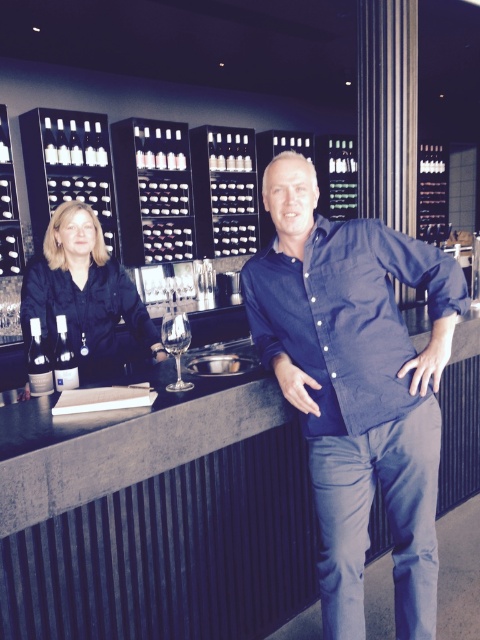
How much distance is there between dark blue denim shirt at center and clear glass wine glass at center?

19.58 inches

Where is `dark blue denim shirt at center`? The image size is (480, 640). dark blue denim shirt at center is located at coordinates (357, 387).

Can you confirm if matte black shirt at left is positioned above clear glass wine glass at center?

Yes.

Is the position of matte black shirt at left more distant than that of clear glass wine glass at center?

Yes, matte black shirt at left is further from the viewer.

At what (x,y) coordinates should I click in order to perform the action: click on matte black shirt at left. Please return your answer as a coordinate pair (x, y). Looking at the image, I should click on (84, 289).

Which of these two, dark blue denim shirt at center or matte black shirt at left, stands shorter?

With less height is matte black shirt at left.

Which is more to the right, dark blue denim shirt at center or matte black shirt at left?

dark blue denim shirt at center

What do you see at coordinates (357, 387) in the screenshot? Image resolution: width=480 pixels, height=640 pixels. I see `dark blue denim shirt at center` at bounding box center [357, 387].

Image resolution: width=480 pixels, height=640 pixels. I want to click on dark blue denim shirt at center, so click(x=357, y=387).